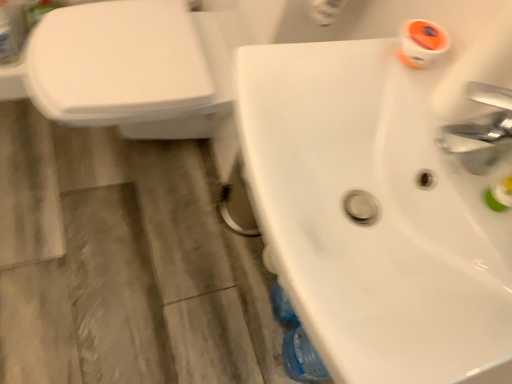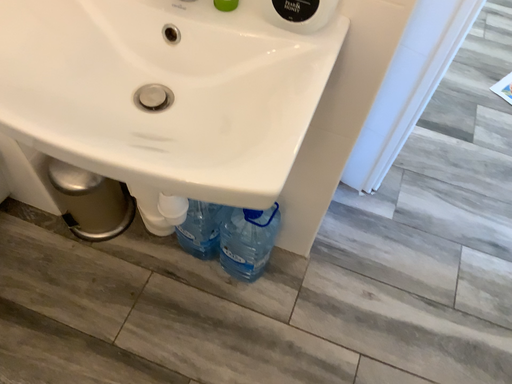
Question: How did the camera likely rotate when shooting the video?

Choices:
 (A) rotated left
 (B) rotated right

Answer: (B)